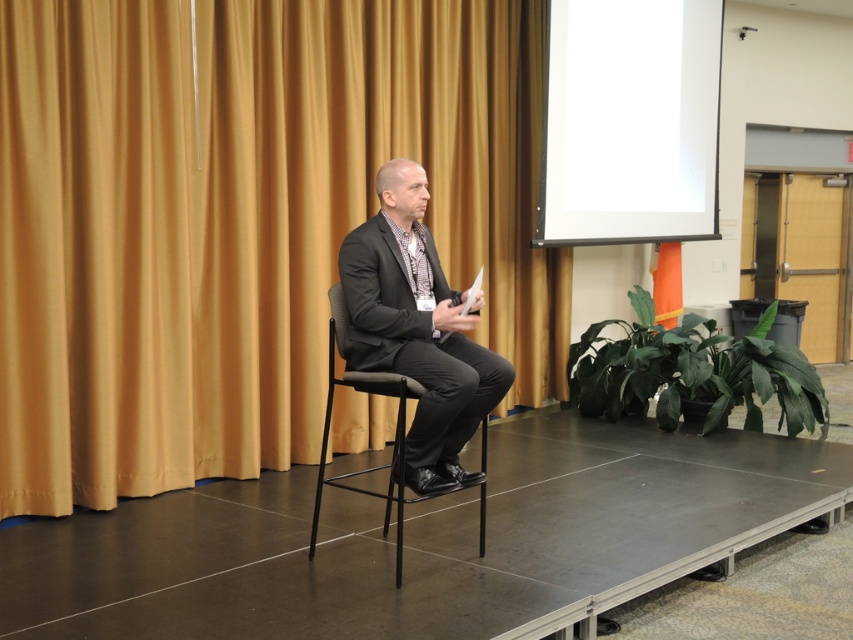
You are an audience member sitting in the front row of the stage. You notice two points marked in the scene. The first point is at coordinate point [625,84] and the second is at coordinate point [473,323]. Which point is closer to you?

Point [625,84] is closer to you because it is further to the viewer than point [473,323].